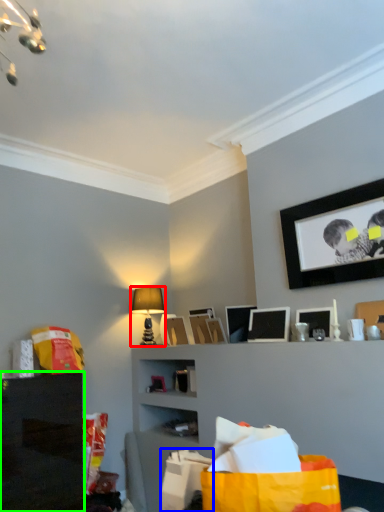
Question: Considering the real-world distances, which object is farthest from table lamp (highlighted by a red box)? shopping bag (highlighted by a blue box) or shelf (highlighted by a green box)?

Choices:
 (A) shopping bag
 (B) shelf

Answer: (A)